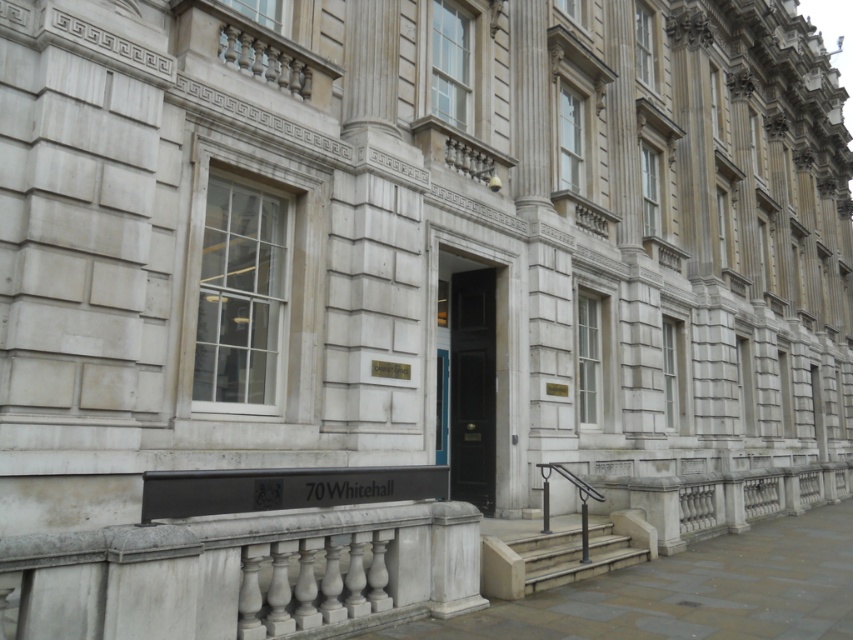
You are a delivery person trying to deliver a package to the building. The door has a height requirement of 2 meters. Can you determine if the black polished wood door at center is tall enough based on its comparison to the smooth concrete stairs at center?

The black polished wood door at center is taller than smooth concrete stairs at center. However, without knowing the exact height of the stairs, we cannot definitively confirm if the door meets the 2 meter requirement. Please measure the door directly or refer to official building specifications for accurate dimensions.